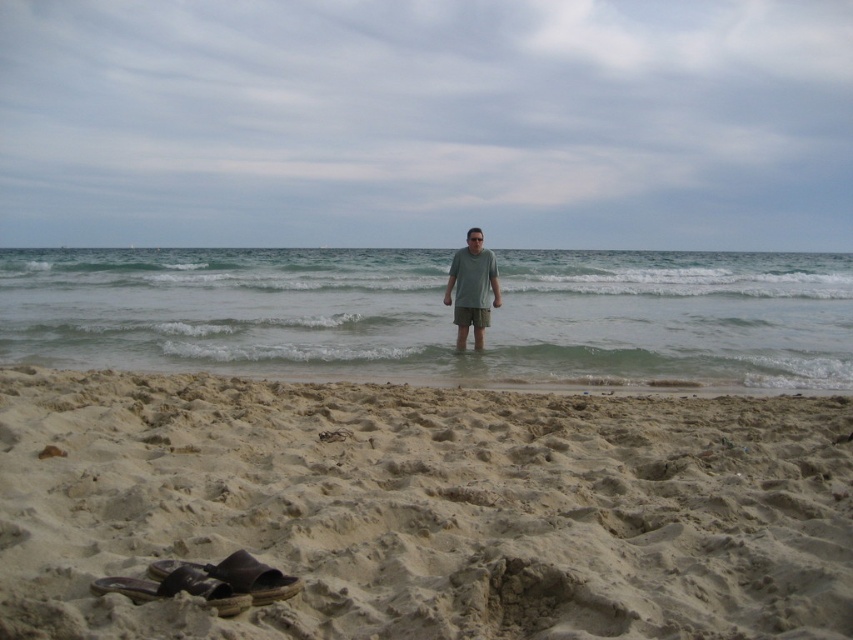
Question: Can you confirm if matte gray shorts at center is smaller than brown leather sandal at lower left?

Choices:
 (A) yes
 (B) no

Answer: (B)

Question: Which of the following is the farthest from the observer?

Choices:
 (A) (180, 566)
 (B) (206, 579)
 (C) (207, 273)

Answer: (C)

Question: Does matte gray shorts at center have a greater width compared to brown leather sandal at lower left?

Choices:
 (A) no
 (B) yes

Answer: (B)

Question: Observing the image, what is the correct spatial positioning of clear water at center in reference to matte gray shorts at center?

Choices:
 (A) left
 (B) right

Answer: (A)

Question: Estimate the real-world distances between objects in this image. Which object is farther from the dark brown leather sandal at lower left?

Choices:
 (A) matte gray shorts at center
 (B) brown leather sandal at lower left
 (C) clear water at center
 (D) light brown sandy beach at lower center

Answer: (C)

Question: Which point appears farthest from the camera in this image?

Choices:
 (A) (225, 600)
 (B) (523, 339)
 (C) (686, 509)
 (D) (271, 602)

Answer: (B)